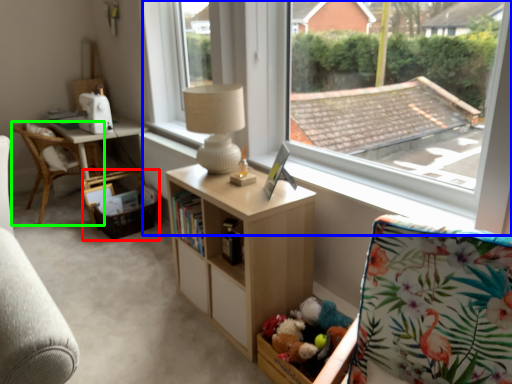
Question: Based on their relative distances, which object is farther from picnic basket (highlighted by a red box)? Choose from window (highlighted by a blue box) and chair (highlighted by a green box).

Choices:
 (A) window
 (B) chair

Answer: (A)